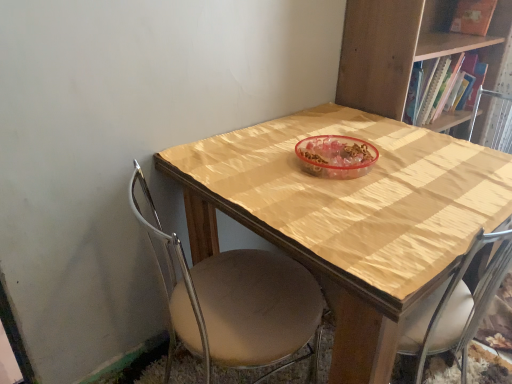
Question: Considering the positions of beige fabric chair at center and matte orange book at upper right in the image, is beige fabric chair at center taller or shorter than matte orange book at upper right?

Choices:
 (A) tall
 (B) short

Answer: (A)

Question: Looking at the image, does beige fabric chair at center seem bigger or smaller compared to matte orange book at upper right?

Choices:
 (A) small
 (B) big

Answer: (B)

Question: Estimate the real-world distances between objects in this image. Which object is farther from the matte orange book at upper right?

Choices:
 (A) wooden table at center
 (B) beige fabric chair at center
 (C) wooden bookcase at upper right

Answer: (B)

Question: Based on their relative distances, which object is nearer to the wooden bookcase at upper right?

Choices:
 (A) beige fabric chair at center
 (B) wooden table at center
 (C) matte orange book at upper right

Answer: (B)